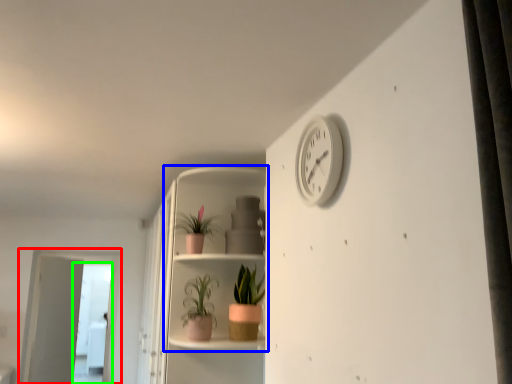
Question: Which is nearer to the screen door (highlighted by a red box)? shelf (highlighted by a blue box) or screen door (highlighted by a green box).

Choices:
 (A) shelf
 (B) screen door

Answer: (B)